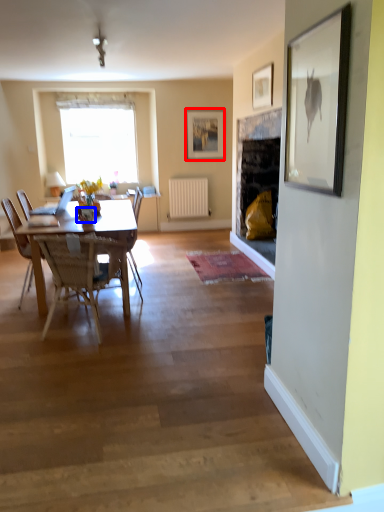
Question: Among these objects, which one is farthest to the camera, picture frame (highlighted by a red box) or vase (highlighted by a blue box)?

Choices:
 (A) picture frame
 (B) vase

Answer: (A)